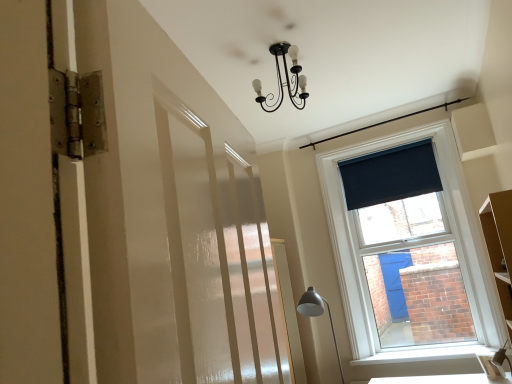
Question: From the image's perspective, is white smooth window sill at lower right above or below matte gray metal floor lamp at lower right?

Choices:
 (A) below
 (B) above

Answer: (A)

Question: Is white smooth window sill at lower right wider or thinner than matte gray metal floor lamp at lower right?

Choices:
 (A) wide
 (B) thin

Answer: (B)

Question: Estimate the real-world distances between objects in this image. Which object is closer to the white smooth window sill at lower right?

Choices:
 (A) white glossy table at lower right
 (B) dark blue fabric at upper right
 (C) matte gray metal floor lamp at lower right

Answer: (A)

Question: Based on their relative distances, which object is nearer to the white glossy table at lower right?

Choices:
 (A) matte gray metal floor lamp at lower right
 (B) dark blue fabric at upper right
 (C) white smooth window sill at lower right

Answer: (C)